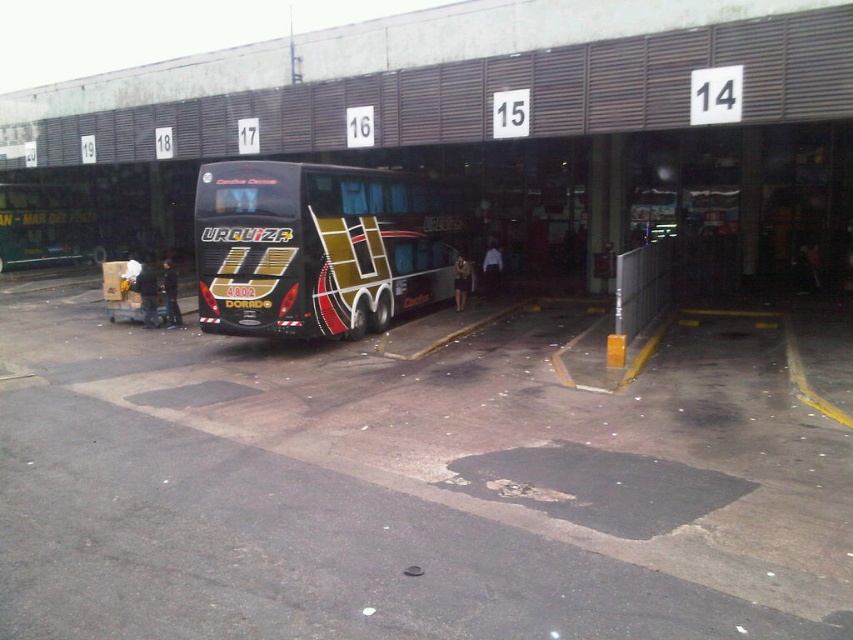
Between point (572, 16) and point (341, 182), which one is positioned behind?

Point (341, 182)

This screenshot has width=853, height=640. What are the coordinates of `metallic bus at center` in the screenshot? It's located at (495, 124).

Is point (27, 480) positioned before point (310, 298)?

Yes, it is.

You are a GUI agent. You are given a task and a screenshot of the screen. Output one action in this format:
    pyautogui.click(x=<x>, y=<y>)
    Task: Click on the shiny metallic bus at center
    
    Given the screenshot: What is the action you would take?
    pyautogui.click(x=410, y=484)

Locate an element on the screen. Image resolution: width=853 pixels, height=640 pixels. shiny metallic bus at center is located at coordinates (410, 484).

The height and width of the screenshot is (640, 853). What are the coordinates of `shiny metallic bus at center` in the screenshot? It's located at (410, 484).

Between shiny metallic bus at center and metallic bus at center, which one has less height?

Standing shorter between the two is shiny metallic bus at center.

This screenshot has height=640, width=853. Describe the element at coordinates (410, 484) in the screenshot. I see `shiny metallic bus at center` at that location.

Locate an element on the screen. shiny metallic bus at center is located at coordinates (410, 484).